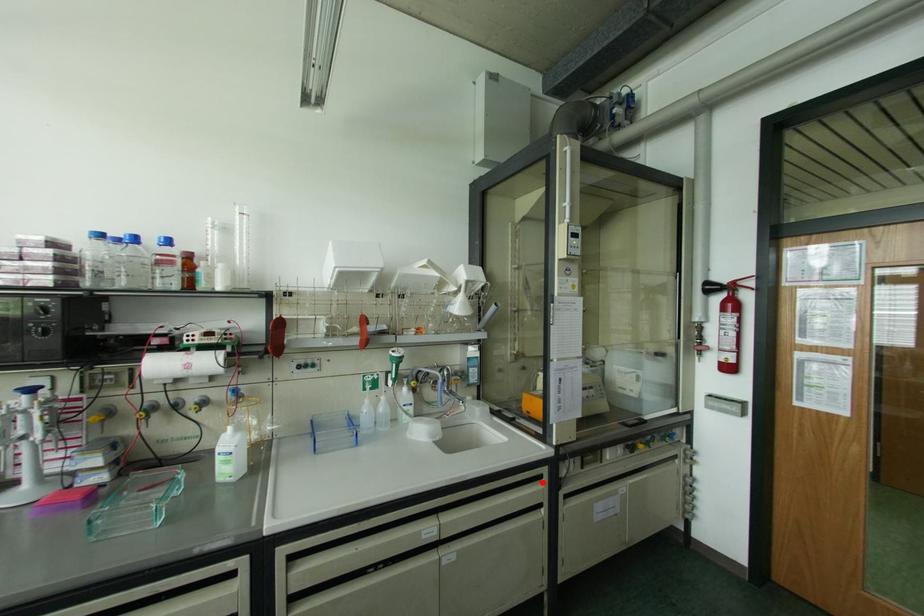
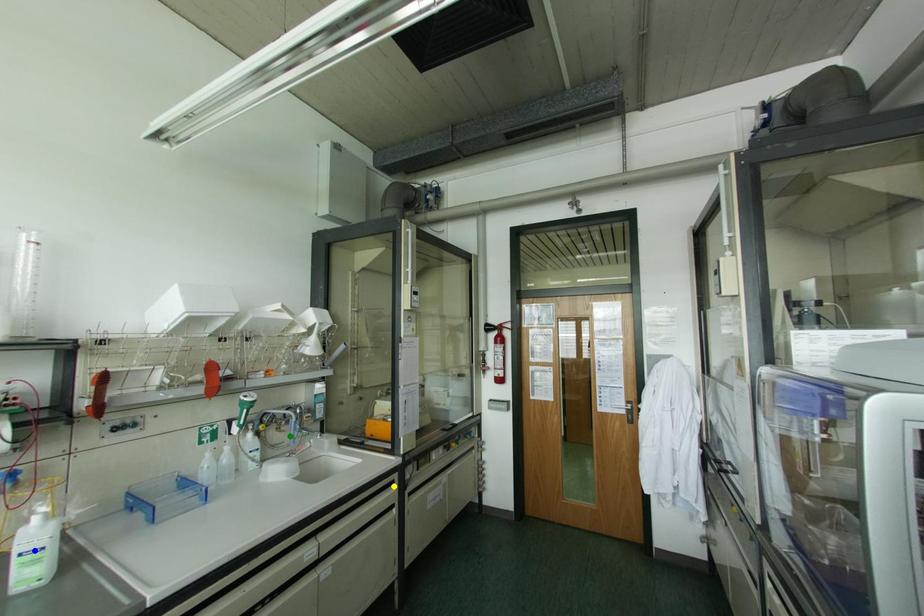
Question: I am providing you with two images of the same scene from different viewpoints. A red point is marked on the first image. You are given multiple points on the second image. In image 2, which mark is for the same physical point as the one in image 1?

Choices:
 (A) blue point
 (B) yellow point
 (C) green point

Answer: (B)